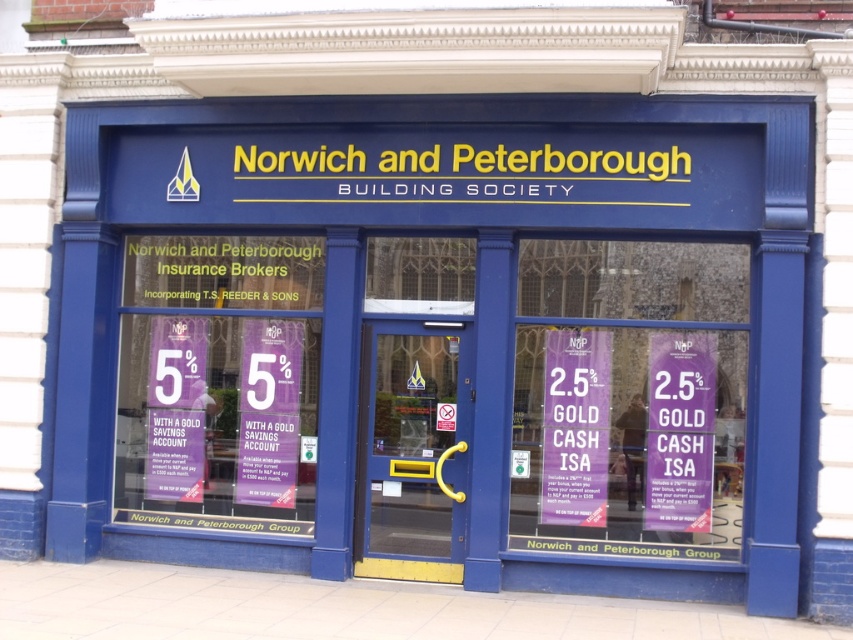
Question: Can you confirm if purple paper at center is positioned below purple paper at left?

Choices:
 (A) yes
 (B) no

Answer: (A)

Question: Which of the following is the farthest from the observer?

Choices:
 (A) (563, 492)
 (B) (212, 280)

Answer: (B)

Question: Which point is farther to the camera?

Choices:
 (A) (527, 436)
 (B) (141, 364)

Answer: (B)

Question: Is purple paper at center below purple paper at left?

Choices:
 (A) yes
 (B) no

Answer: (A)

Question: Is the position of purple paper at center less distant than that of purple paper at left?

Choices:
 (A) no
 (B) yes

Answer: (B)

Question: Among these objects, which one is farthest from the camera?

Choices:
 (A) purple paper at left
 (B) purple paper at center

Answer: (A)